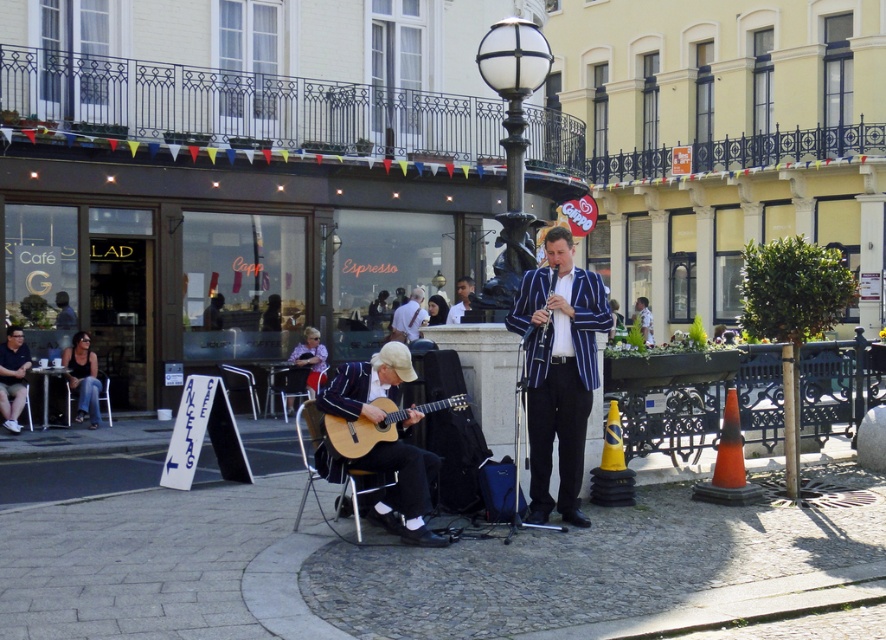
Locate an element on the screen. striped fabric blazer at center is located at coordinates (558, 369).

Is striped fabric blazer at center thinner than white glass lamp post at upper center?

No, striped fabric blazer at center is not thinner than white glass lamp post at upper center.

Is point (517, 307) positioned behind point (514, 182)?

No, it is in front of (514, 182).

This screenshot has height=640, width=886. Identify the location of striped fabric blazer at center. (558, 369).

Between point (579, 390) and point (343, 420), which one is positioned behind?

The point (579, 390) is more distant.

Is striped fabric blazer at center below light brown wooden guitar at lower center?

No, striped fabric blazer at center is not below light brown wooden guitar at lower center.

Who is more distant from viewer, (x=538, y=364) or (x=400, y=417)?

Positioned behind is point (x=538, y=364).

You are a GUI agent. You are given a task and a screenshot of the screen. Output one action in this format:
    pyautogui.click(x=<x>, y=<y>)
    Task: Click on the striped fabric blazer at center
    The height and width of the screenshot is (640, 886).
    Given the screenshot: What is the action you would take?
    pyautogui.click(x=558, y=369)

Can you confirm if striped fabric blazer at center is wider than denim jeans at lower left?

Indeed, striped fabric blazer at center has a greater width compared to denim jeans at lower left.

Can you confirm if striped fabric blazer at center is smaller than denim jeans at lower left?

No, striped fabric blazer at center is not smaller than denim jeans at lower left.

Describe the element at coordinates (558, 369) in the screenshot. I see `striped fabric blazer at center` at that location.

Locate an element on the screen. The width and height of the screenshot is (886, 640). striped fabric blazer at center is located at coordinates (558, 369).